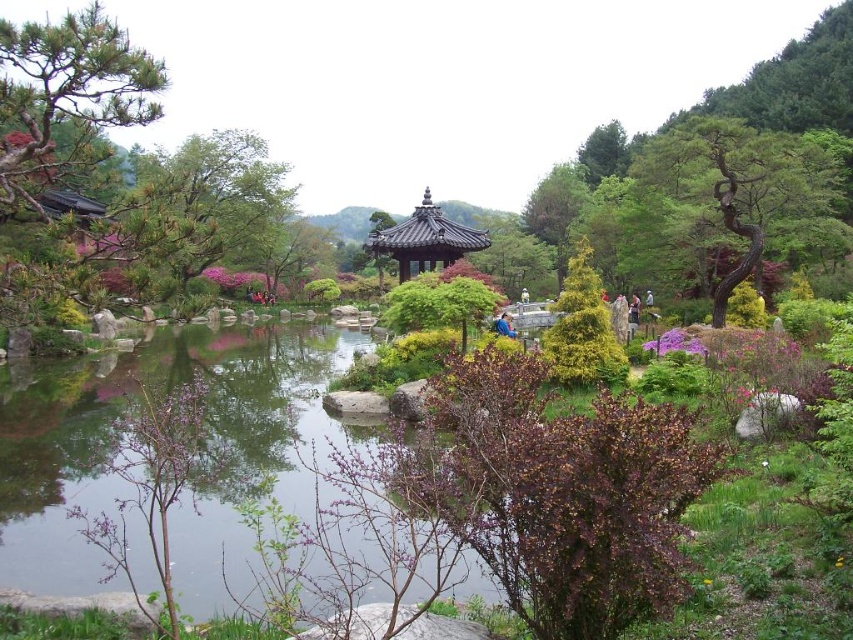
Question: Is green textured bush at center closer to the viewer compared to purple matte flower at center-right?

Choices:
 (A) no
 (B) yes

Answer: (B)

Question: Estimate the real-world distances between objects in this image. Which object is closer to the purple matte flower at center-right?

Choices:
 (A) green textured bush at center
 (B) bare bark tree at upper right
 (C) shiny dark brown gazebo at center

Answer: (A)

Question: Estimate the real-world distances between objects in this image. Which object is farther from the green textured bush at center?

Choices:
 (A) purple matte flower at center-right
 (B) shiny dark brown gazebo at center
 (C) bare bark tree at upper right

Answer: (B)

Question: Which point is closer to the camera taking this photo?

Choices:
 (A) (825, 253)
 (B) (596, 284)

Answer: (B)

Question: Does shiny dark brown gazebo at center lie in front of purple matte flower at center-right?

Choices:
 (A) no
 (B) yes

Answer: (A)

Question: Is bare bark tree at upper right closer to the viewer compared to purple matte flower at center-right?

Choices:
 (A) no
 (B) yes

Answer: (A)